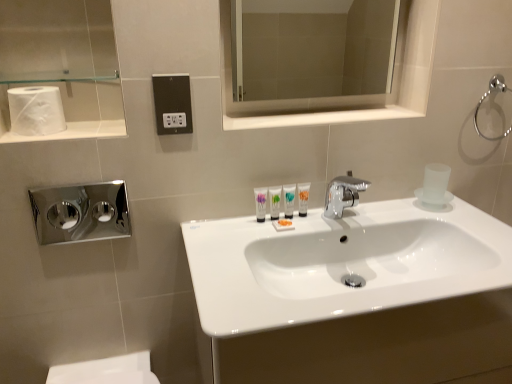
You are a GUI agent. You are given a task and a screenshot of the screen. Output one action in this format:
    pyautogui.click(x=<x>, y=<y>)
    Task: Click on the free region on the left part of white glossy tube at center, which is the 2th toiletry from left to right
    This screenshot has height=384, width=512.
    Given the screenshot: What is the action you would take?
    pyautogui.click(x=230, y=230)